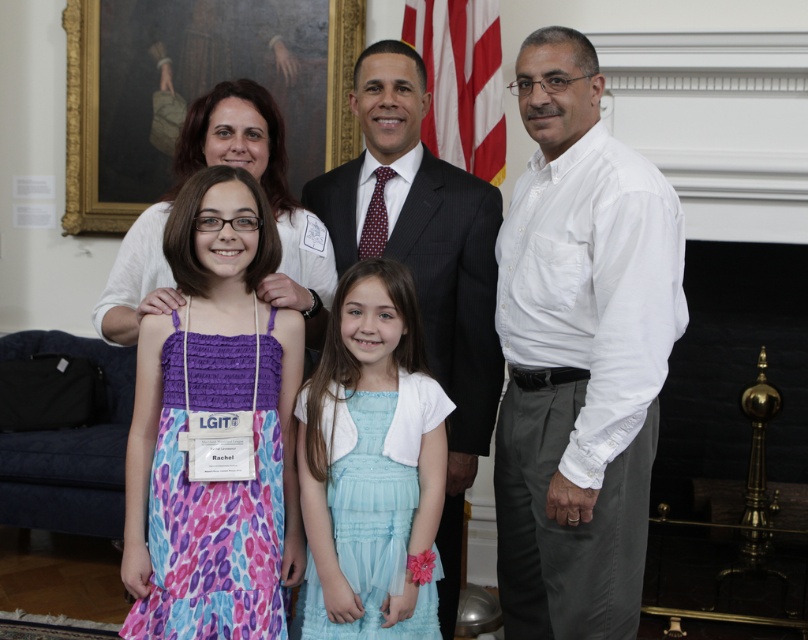
Looking at this image, can you confirm if matte white dress at center is taller than dark gray suit at center?

Incorrect, matte white dress at center's height is not larger of dark gray suit at center's.

Is matte white dress at center bigger than dark gray suit at center?

Yes, matte white dress at center is bigger than dark gray suit at center.

Between point (497, 307) and point (470, 420), which one is positioned in front?

Point (497, 307)

The width and height of the screenshot is (808, 640). In order to click on matte white dress at center in this screenshot , I will do `click(579, 353)`.

The height and width of the screenshot is (640, 808). What do you see at coordinates (196, 90) in the screenshot?
I see `gold-framed portrait at upper center` at bounding box center [196, 90].

Can you confirm if gold-framed portrait at upper center is bigger than dark gray suit at center?

Yes, gold-framed portrait at upper center is bigger than dark gray suit at center.

The image size is (808, 640). What are the coordinates of `gold-framed portrait at upper center` in the screenshot? It's located at (196, 90).

Does point (617, 499) lie in front of point (175, 161)?

Yes, point (617, 499) is in front of point (175, 161).

Can you confirm if matte white dress at center is positioned above white fabric shirt at upper left?

Actually, matte white dress at center is below white fabric shirt at upper left.

Is point (615, 442) closer to camera compared to point (152, 310)?

Yes, it is in front of point (152, 310).

This screenshot has height=640, width=808. What are the coordinates of `matte white dress at center` in the screenshot? It's located at (579, 353).